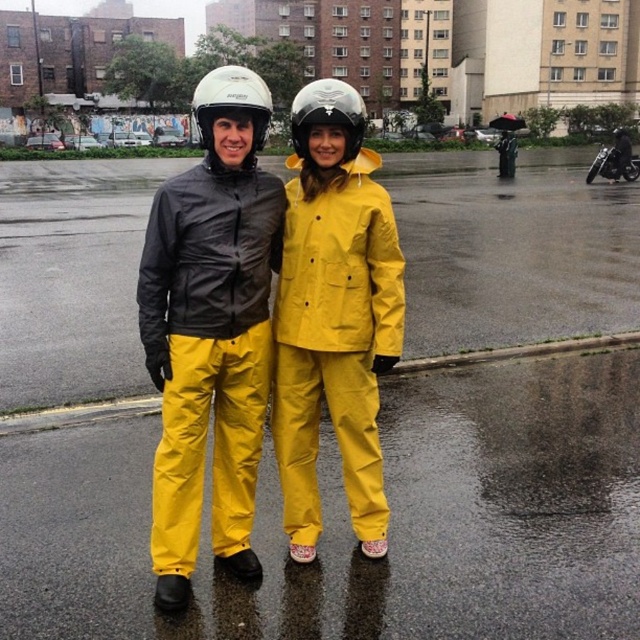
You are a delivery person who needs to reach the shiny black motorcycle at upper right. You are currently standing next to the white matte helmet at upper center. The delivery requires you to be there within 10 seconds. Considering the distance between them, can you make it on time if you run at an average speed of 3.5 meters per second?

The distance between the white matte helmet at upper center and the shiny black motorcycle at upper right is 29.93 meters. To cover this distance in 10 seconds, you would need to run at a speed of at least 2.993 meters per second. Since your average speed is 3.5 meters per second, which is faster than required, you can reach the motorcycle in time.

You are a delivery person who needs to check if your white matte helmet at upper center can fit into the storage compartment of the shiny black motorcycle at upper right. According to the scene description, which object is taller?

The white matte helmet at upper center is taller than the shiny black motorcycle at upper right, so it might not fit into the storage compartment.